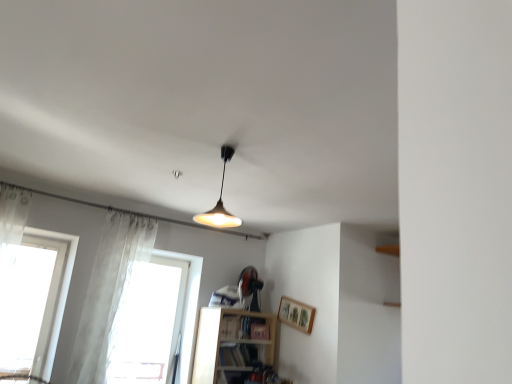
Question: Considering the relative sizes of metallic silver fan at center and transparent fabric at lower left, which appears as the 1th window when viewed from the right, in the image provided, is metallic silver fan at center wider than transparent fabric at lower left, which appears as the 1th window when viewed from the right,?

Choices:
 (A) yes
 (B) no

Answer: (A)

Question: Is metallic silver fan at center far from transparent fabric at lower left, which ranks as the second window in left-to-right order?

Choices:
 (A) no
 (B) yes

Answer: (A)

Question: Does metallic silver fan at center have a lesser height compared to transparent fabric at lower left, which ranks as the second window in left-to-right order?

Choices:
 (A) no
 (B) yes

Answer: (B)

Question: From the image's perspective, does metallic silver fan at center appear higher than transparent fabric at lower left, which appears as the 1th window when viewed from the right?

Choices:
 (A) yes
 (B) no

Answer: (A)

Question: From a real-world perspective, is metallic silver fan at center on top of transparent fabric at lower left, which ranks as the second window in left-to-right order?

Choices:
 (A) yes
 (B) no

Answer: (A)

Question: Considering the relative sizes of metallic silver fan at center and transparent fabric at lower left, which appears as the 1th window when viewed from the right, in the image provided, is metallic silver fan at center taller than transparent fabric at lower left, which appears as the 1th window when viewed from the right,?

Choices:
 (A) no
 (B) yes

Answer: (A)

Question: Is wooden at lower center completely or partially inside hardcover book at lower center, which is the 1th book in bottom-to-top order?

Choices:
 (A) no
 (B) yes

Answer: (A)

Question: Can you confirm if hardcover book at lower center, which is the 1th book in bottom-to-top order, is shorter than wooden at lower center?

Choices:
 (A) no
 (B) yes

Answer: (B)

Question: Does hardcover book at lower center, which is the 1th book in bottom-to-top order, lie in front of wooden at lower center?

Choices:
 (A) yes
 (B) no

Answer: (B)

Question: Considering the relative sizes of hardcover book at lower center, which is the 1th book in bottom-to-top order, and wooden at lower center in the image provided, is hardcover book at lower center, which is the 1th book in bottom-to-top order, taller than wooden at lower center?

Choices:
 (A) yes
 (B) no

Answer: (B)

Question: From the image's perspective, is hardcover book at lower center, the second book positioned from the top, over wooden at lower center?

Choices:
 (A) yes
 (B) no

Answer: (B)

Question: Is hardcover book at lower center, the second book positioned from the top, behind wooden at lower center?

Choices:
 (A) no
 (B) yes

Answer: (B)

Question: Is wooden framed picture at upper right wider than matte black bookshelf at lower center, which is counted as the 2th book, starting from the bottom?

Choices:
 (A) yes
 (B) no

Answer: (B)